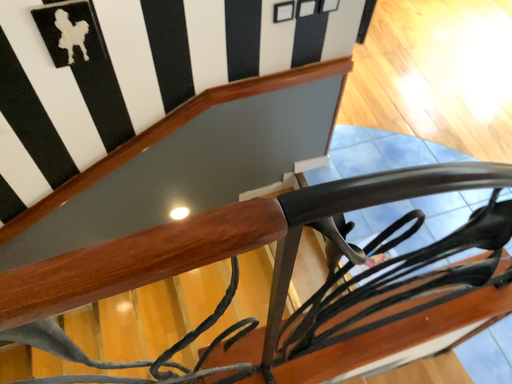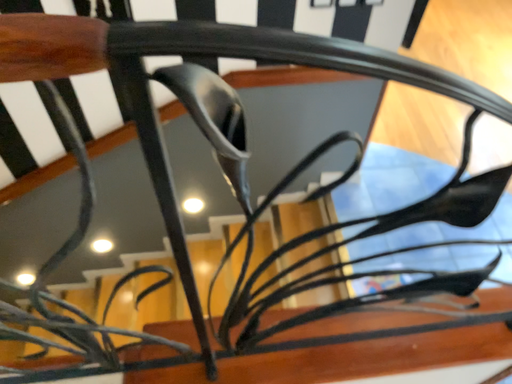
Question: How did the camera likely rotate when shooting the video?

Choices:
 (A) rotated right
 (B) rotated left

Answer: (B)